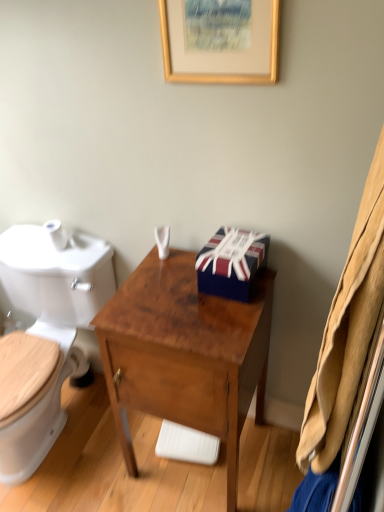
Question: Is point (160, 352) positioned closer to the camera than point (258, 0)?

Choices:
 (A) farther
 (B) closer

Answer: (A)

Question: Is brown wood desk at center inside the boundaries of gold wooden picture frame at upper center, or outside?

Choices:
 (A) outside
 (B) inside

Answer: (A)

Question: Which is farther from the white glossy toilet at left?

Choices:
 (A) white plastic container at center
 (B) union jack-patterned gift box at center
 (C) white matte toilet paper at left
 (D) gold wooden picture frame at upper center
 (E) brown wood desk at center

Answer: (D)

Question: Based on their relative distances, which object is farther from the brown wood desk at center?

Choices:
 (A) white glossy toilet at left
 (B) white plastic container at center
 (C) gold wooden picture frame at upper center
 (D) white matte toilet paper at left
 (E) union jack-patterned gift box at center

Answer: (C)